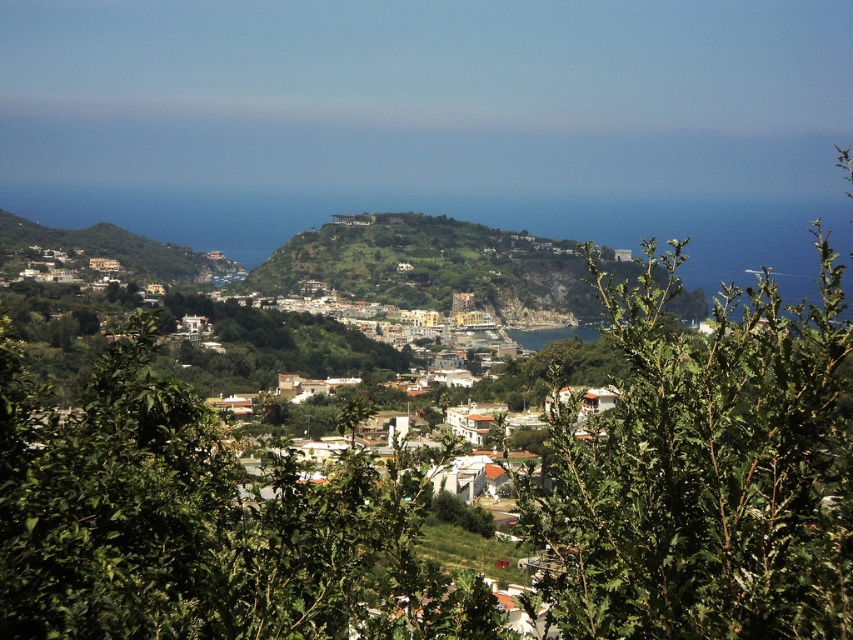
From the picture: Which of these two, green leafy bush at center or green leafy tree at center, stands taller?

green leafy bush at center is taller.

Who is higher up, green leafy bush at center or green leafy tree at center?

green leafy bush at center is above.

Between point (631, 529) and point (170, 556), which one is positioned behind?

Positioned behind is point (631, 529).

Locate an element on the screen. The height and width of the screenshot is (640, 853). green leafy bush at center is located at coordinates (705, 467).